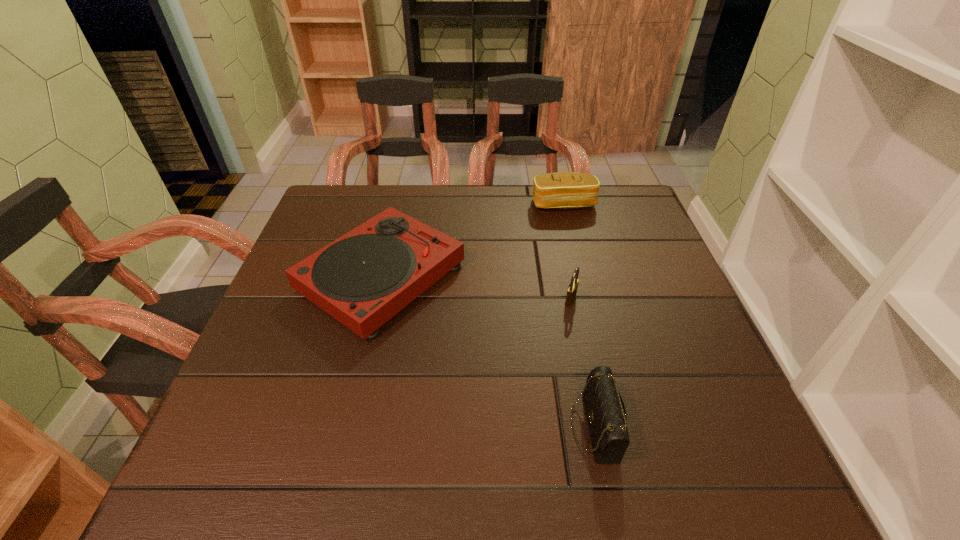
Where is `blank region between the farther clutch bag and the padlock`? blank region between the farther clutch bag and the padlock is located at coordinates (567, 252).

Image resolution: width=960 pixels, height=540 pixels. I want to click on free point between the padlock and the leftmost object, so click(476, 288).

Identify which object is located as the third nearest to the farthest object. Please provide its 2D coordinates. Your answer should be formatted as a tuple, i.e. [(x, y)], where the tuple contains the x and y coordinates of a point satisfying the conditions above.

[(606, 415)]

Find the location of a particular element. The height and width of the screenshot is (540, 960). object that is the closest to the padlock is located at coordinates (606, 415).

You are a GUI agent. You are given a task and a screenshot of the screen. Output one action in this format:
    pyautogui.click(x=<x>, y=<y>)
    Task: Click on the free location that satisfies the following two spatial constraints: 1. on the zipper side of the farther clutch bag; 2. on the front flap of the nearest object
    The image size is (960, 540).
    Given the screenshot: What is the action you would take?
    pyautogui.click(x=618, y=427)

Locate an element on the screen. Image resolution: width=960 pixels, height=540 pixels. vacant space that satisfies the following two spatial constraints: 1. on the zipper side of the farthest object; 2. on the front flap of the nearer clutch bag is located at coordinates (618, 427).

This screenshot has height=540, width=960. What are the coordinates of `vacant space that satisfies the following two spatial constraints: 1. on the zipper side of the farthest object; 2. on the front flap of the nearest object` in the screenshot? It's located at (618, 427).

Where is `vacant region that satisfies the following two spatial constraints: 1. on the front side of the leftmost object; 2. on the left side of the padlock`? vacant region that satisfies the following two spatial constraints: 1. on the front side of the leftmost object; 2. on the left side of the padlock is located at coordinates (376, 300).

You are a GUI agent. You are given a task and a screenshot of the screen. Output one action in this format:
    pyautogui.click(x=<x>, y=<y>)
    Task: Click on the blank area in the image that satisfies the following two spatial constraints: 1. on the zipper side of the farthest object; 2. on the front flap of the nearest object
    This screenshot has height=540, width=960.
    Given the screenshot: What is the action you would take?
    pyautogui.click(x=618, y=427)